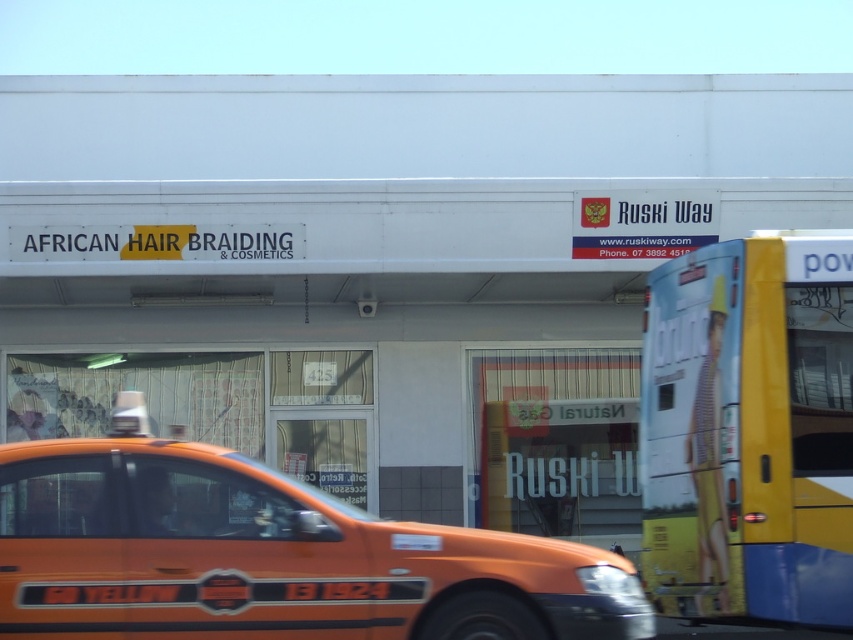
You are a pedestrian standing in front of the storefront. You see an orange matte taxi at center and a yellow matte bus at right. Which vehicle is closer to the storefront entrance?

The orange matte taxi at center is closer to the storefront entrance because it is positioned to the left of the yellow matte bus at right, which is further away.